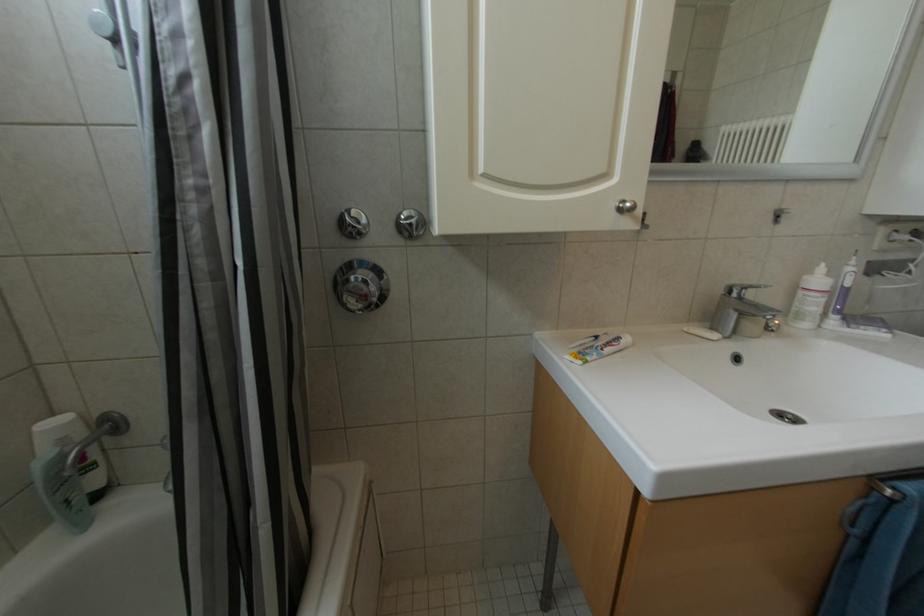
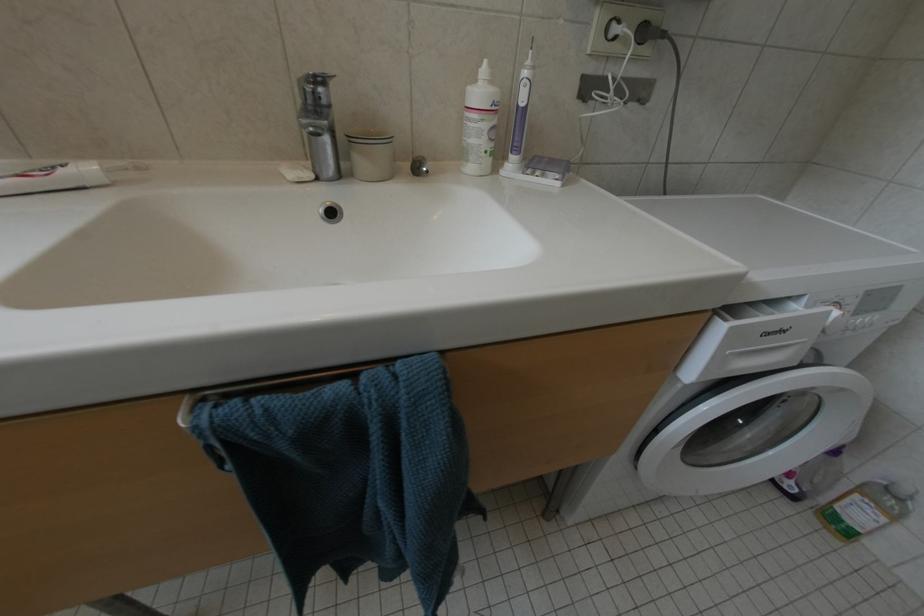
Question: The images are taken continuously from a first-person perspective. In which direction are you moving?

Choices:
 (A) Left
 (B) Right
 (C) Forward
 (D) Backward

Answer: (B)